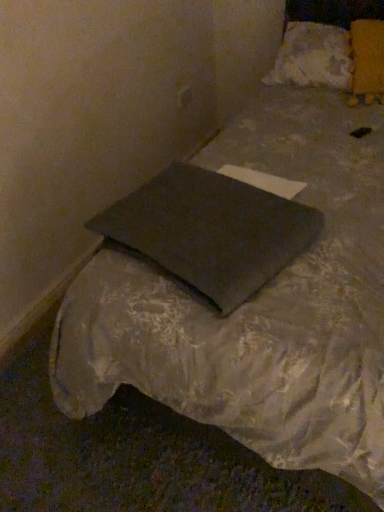
Question: Is dark gray fabric pillow at center, positioned as the third pillow in top-to-bottom order, outside of yellow fabric pillow at upper right, which is the 2th pillow from bottom to top?

Choices:
 (A) no
 (B) yes

Answer: (B)

Question: Does dark gray fabric pillow at center, marked as the 1th pillow in a front-to-back arrangement, have a greater width compared to yellow fabric pillow at upper right, arranged as the 2th pillow when viewed from the front?

Choices:
 (A) no
 (B) yes

Answer: (B)

Question: Is dark gray fabric pillow at center, marked as the 1th pillow in a front-to-back arrangement, oriented away from yellow fabric pillow at upper right, arranged as the 2th pillow when viewed from the front?

Choices:
 (A) no
 (B) yes

Answer: (B)

Question: Can you confirm if dark gray fabric pillow at center, marked as the 3th pillow in a back-to-front arrangement, is positioned to the left of yellow fabric pillow at upper right, arranged as the 2th pillow when viewed from the front?

Choices:
 (A) no
 (B) yes

Answer: (B)

Question: Does dark gray fabric pillow at center, marked as the 3th pillow in a back-to-front arrangement, have a lesser width compared to yellow fabric pillow at upper right, acting as the second pillow starting from the back?

Choices:
 (A) yes
 (B) no

Answer: (B)

Question: Is yellow fabric pillow at upper right, arranged as the 2th pillow when viewed from the front, situated inside white fluffy pillow at upper right, the 1th pillow from the top, or outside?

Choices:
 (A) outside
 (B) inside

Answer: (B)

Question: From a real-world perspective, is yellow fabric pillow at upper right, acting as the second pillow starting from the back, above or below white fluffy pillow at upper right, marked as the first pillow in a back-to-front arrangement?

Choices:
 (A) above
 (B) below

Answer: (A)

Question: Visually, is yellow fabric pillow at upper right, which is the 2th pillow from bottom to top, positioned to the left or to the right of white fluffy pillow at upper right, which is the third pillow in bottom-to-top order?

Choices:
 (A) right
 (B) left

Answer: (A)

Question: Is yellow fabric pillow at upper right, which is counted as the 2th pillow, starting from the top, taller or shorter than white fluffy pillow at upper right, which appears as the 3th pillow when viewed from the front?

Choices:
 (A) tall
 (B) short

Answer: (A)

Question: Do you think dark gray fabric pillow at center, positioned as the third pillow in top-to-bottom order, is within white fluffy pillow at upper right, marked as the first pillow in a back-to-front arrangement, or outside of it?

Choices:
 (A) inside
 (B) outside

Answer: (B)

Question: From the image's perspective, relative to white fluffy pillow at upper right, marked as the first pillow in a back-to-front arrangement, is dark gray fabric pillow at center, positioned as the third pillow in top-to-bottom order, above or below?

Choices:
 (A) below
 (B) above

Answer: (A)

Question: Considering the positions of dark gray fabric pillow at center, marked as the 1th pillow in a front-to-back arrangement, and white fluffy pillow at upper right, marked as the first pillow in a back-to-front arrangement, in the image, is dark gray fabric pillow at center, marked as the 1th pillow in a front-to-back arrangement, wider or thinner than white fluffy pillow at upper right, marked as the first pillow in a back-to-front arrangement,?

Choices:
 (A) wide
 (B) thin

Answer: (A)

Question: In terms of height, does dark gray fabric pillow at center, which is the first pillow from bottom to top, look taller or shorter compared to white fluffy pillow at upper right, which appears as the 3th pillow when viewed from the front?

Choices:
 (A) tall
 (B) short

Answer: (B)

Question: In the image, is dark gray fabric pillow at center, positioned as the third pillow in top-to-bottom order, positioned in front of or behind yellow fabric pillow at upper right, which is counted as the 2th pillow, starting from the top?

Choices:
 (A) behind
 (B) front

Answer: (B)

Question: From the image's perspective, relative to yellow fabric pillow at upper right, which is the 2th pillow from bottom to top, is dark gray fabric pillow at center, positioned as the third pillow in top-to-bottom order, above or below?

Choices:
 (A) below
 (B) above

Answer: (A)